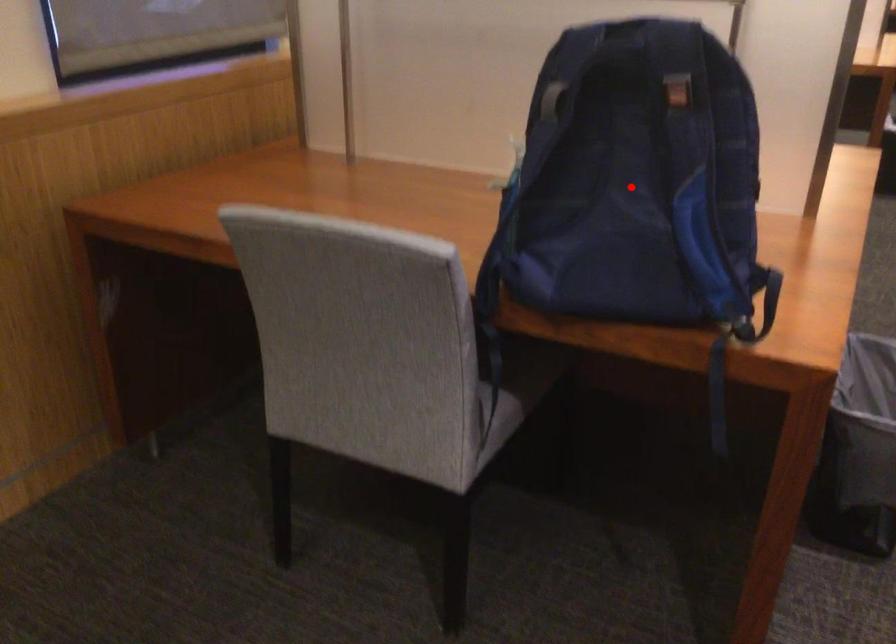
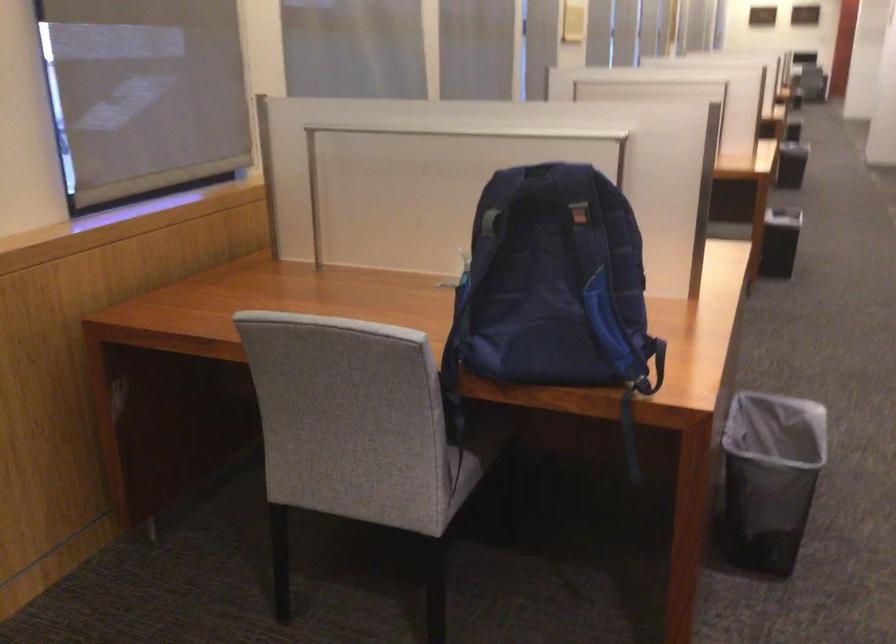
Question: I am providing you with two images of the same scene from different viewpoints. A red point is shown in image1. For the corresponding object point in image2, is it positioned nearer or farther from the camera?

Choices:
 (A) Nearer
 (B) Farther

Answer: (B)